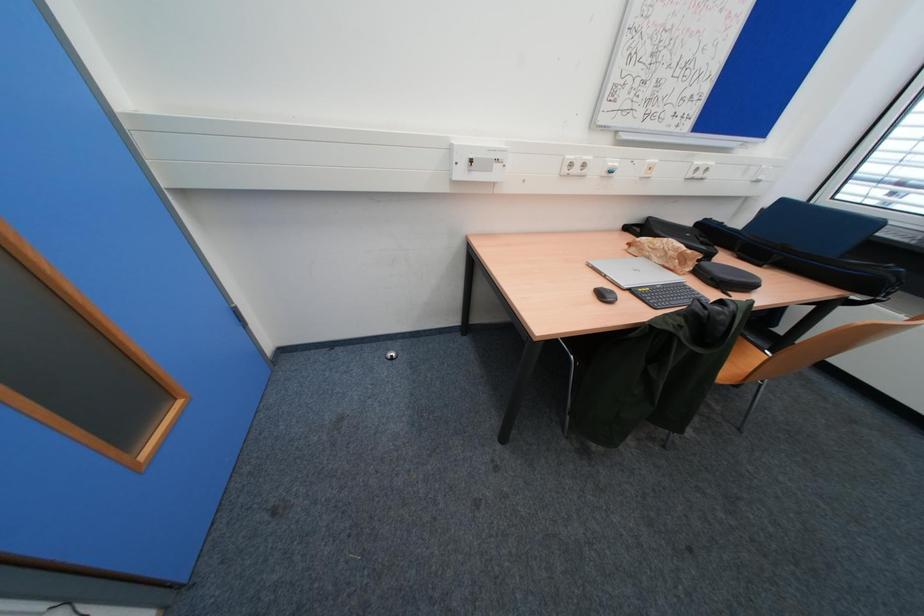
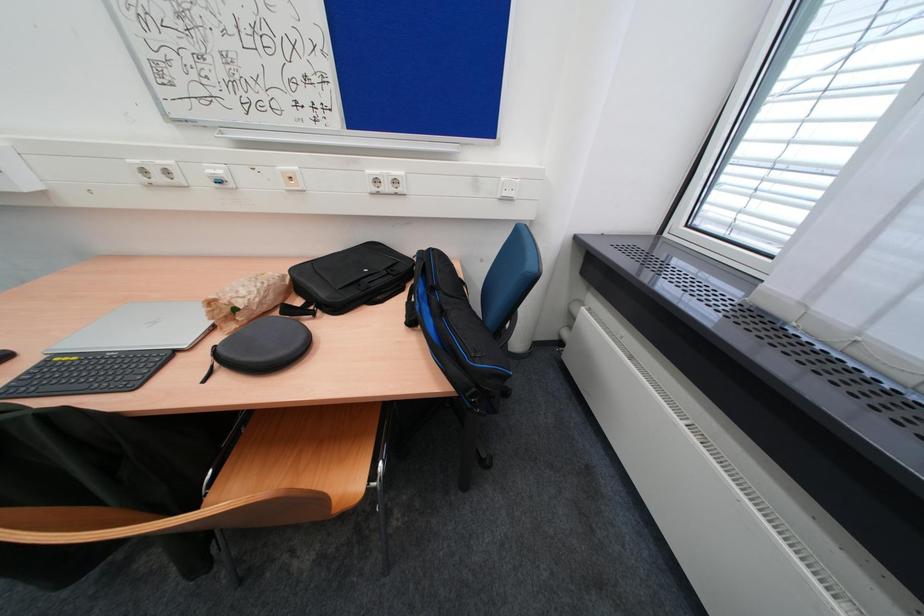
Question: The images are taken continuously from a first-person perspective. In which direction are you moving?

Choices:
 (A) Left
 (B) Right
 (C) Forward
 (D) Backward

Answer: (B)